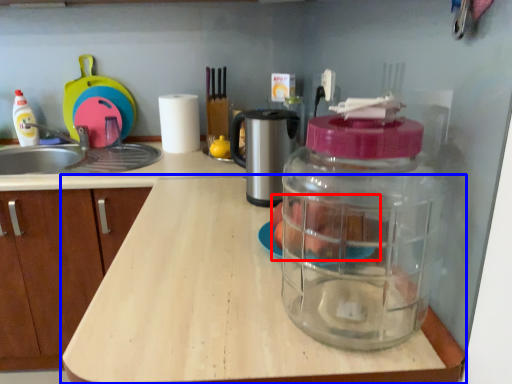
Question: Which point is closer to the camera, food (highlighted by a red box) or countertop (highlighted by a blue box)?

Choices:
 (A) food
 (B) countertop

Answer: (B)